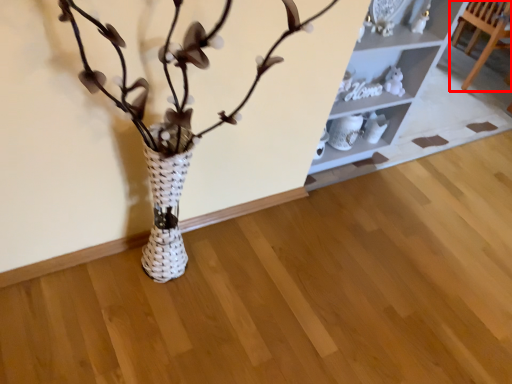
Question: Observing the image, what is the correct spatial positioning of furniture (annotated by the red box) in reference to shelf?

Choices:
 (A) left
 (B) right

Answer: (B)